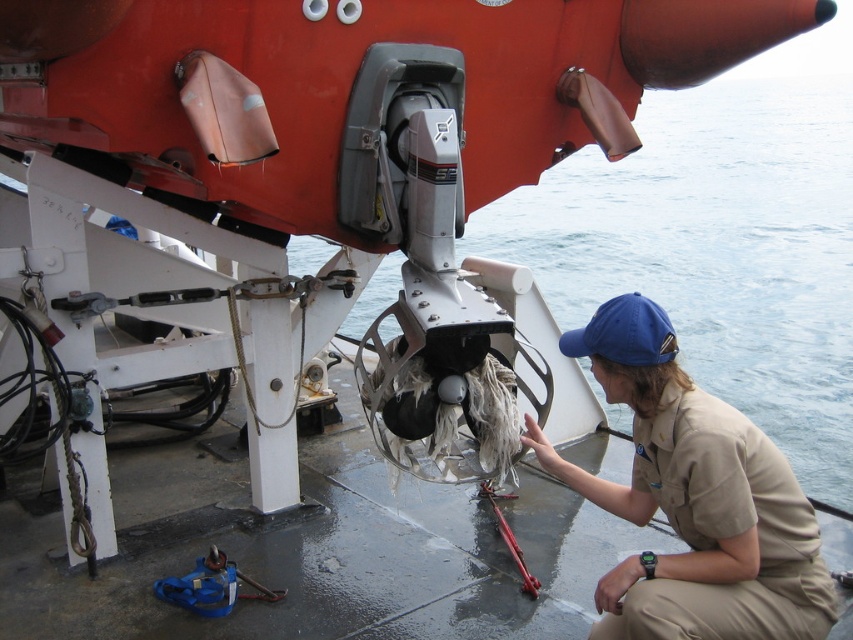
You are a deckhand on the boat and need to identify clothing items. Which item is wider, the khaki uniform at lower right or the blue fabric baseball cap at center?

The khaki uniform at lower right is wider than the blue fabric baseball cap at center according to the description.

You are a photographer standing on the boat deck. You want to take a photo of the khaki uniform at lower right without the camera in the shot. Can you move 2 meters to your left to avoid the camera?

The khaki uniform at lower right and camera are 2.16 meters apart from each other. Moving 2 meters to the left would be sufficient to position yourself outside the camera field of view, ensuring the camera isn